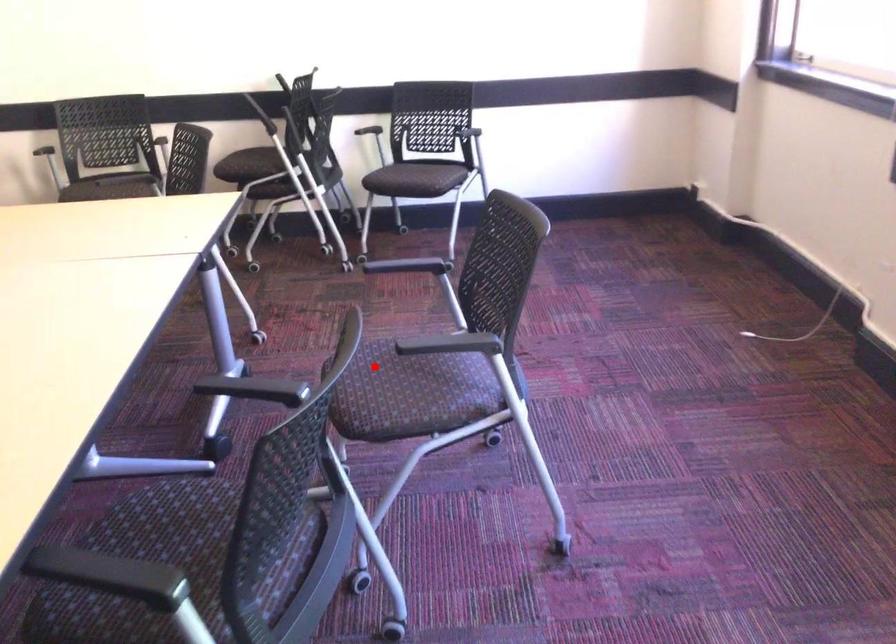
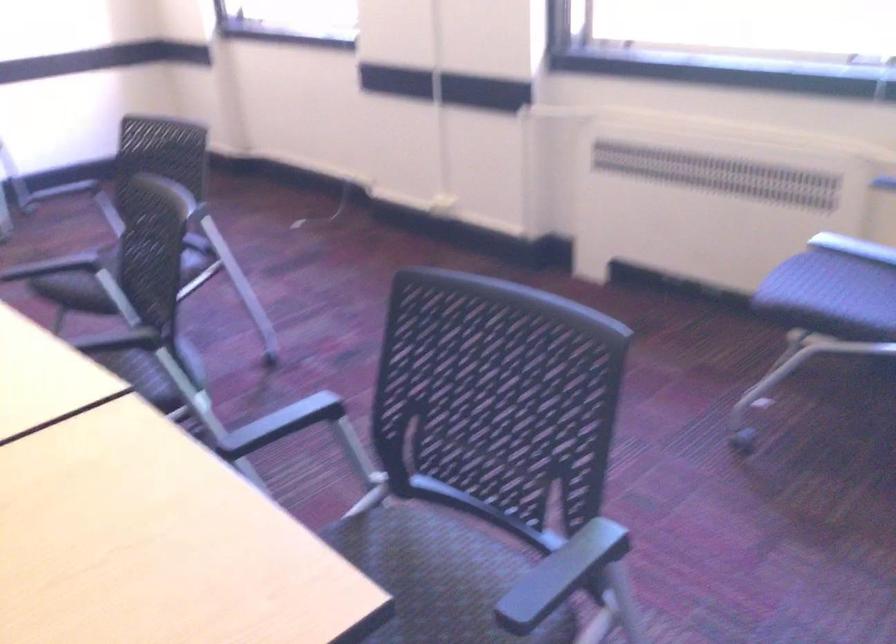
Question: I am providing you with two images of the same scene from different viewpoints. A red point is marked on the first image. At the location where the point appears in image 1, is it still visible in image 2?

Choices:
 (A) Yes
 (B) No

Answer: (B)